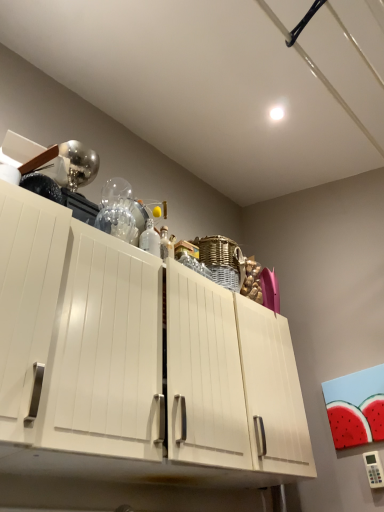
Question: From a real-world perspective, is white glossy bottle at upper center on white glossy cabinet at center?

Choices:
 (A) no
 (B) yes

Answer: (B)

Question: Can you confirm if white glossy bottle at upper center is thinner than white glossy cabinet at center?

Choices:
 (A) yes
 (B) no

Answer: (A)

Question: Is white glossy bottle at upper center located outside white glossy cabinet at center?

Choices:
 (A) yes
 (B) no

Answer: (A)

Question: Does white glossy bottle at upper center have a larger size compared to white glossy cabinet at center?

Choices:
 (A) yes
 (B) no

Answer: (B)

Question: Does white glossy bottle at upper center appear on the right side of white glossy cabinet at center?

Choices:
 (A) yes
 (B) no

Answer: (B)

Question: Is white glossy cabinet at center at the back of white glossy bottle at upper center?

Choices:
 (A) yes
 (B) no

Answer: (B)

Question: From the image's perspective, is white glossy cabinet at center below white glossy bottle at upper center?

Choices:
 (A) no
 (B) yes

Answer: (B)

Question: Does white glossy cabinet at center lie in front of white glossy bottle at upper center?

Choices:
 (A) yes
 (B) no

Answer: (A)

Question: Considering the relative sizes of white glossy cabinet at center and white glossy bottle at upper center in the image provided, is white glossy cabinet at center bigger than white glossy bottle at upper center?

Choices:
 (A) no
 (B) yes

Answer: (B)

Question: From a real-world perspective, is white glossy cabinet at center under white glossy bottle at upper center?

Choices:
 (A) yes
 (B) no

Answer: (A)

Question: Considering the relative positions of white glossy cabinet at center and white glossy bottle at upper center in the image provided, is white glossy cabinet at center to the right of white glossy bottle at upper center from the viewer's perspective?

Choices:
 (A) no
 (B) yes

Answer: (B)

Question: Is white glossy cabinet at center outside of white glossy bottle at upper center?

Choices:
 (A) no
 (B) yes

Answer: (B)

Question: Looking at their shapes, would you say white glossy cabinet at center is wider or thinner than white glossy bottle at upper center?

Choices:
 (A) thin
 (B) wide

Answer: (B)